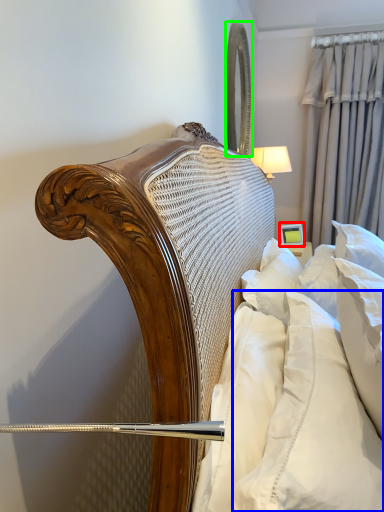
Question: Considering the real-world distances, which object is farthest from picture frame (highlighted by a red box)? pillow (highlighted by a blue box) or mirror (highlighted by a green box)?

Choices:
 (A) pillow
 (B) mirror

Answer: (A)